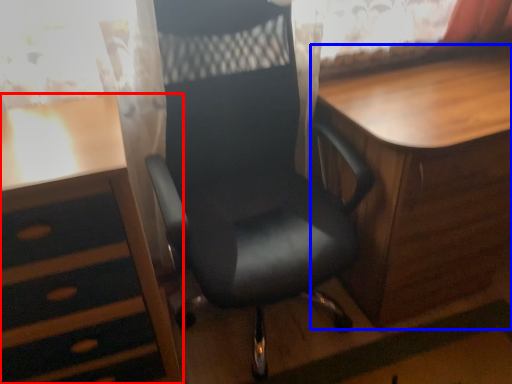
Question: Among these objects, which one is nearest to the camera, desk (highlighted by a red box) or table (highlighted by a blue box)?

Choices:
 (A) desk
 (B) table

Answer: (A)